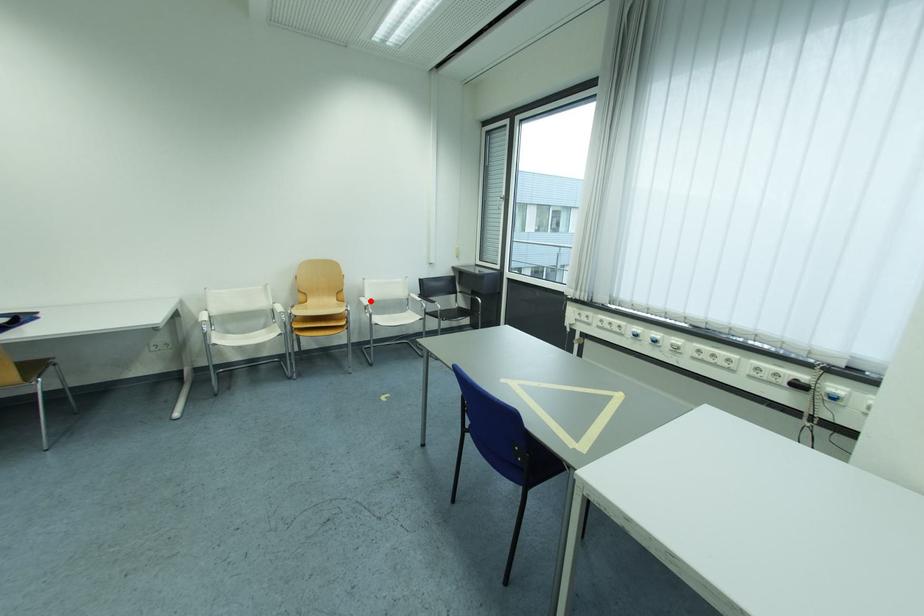
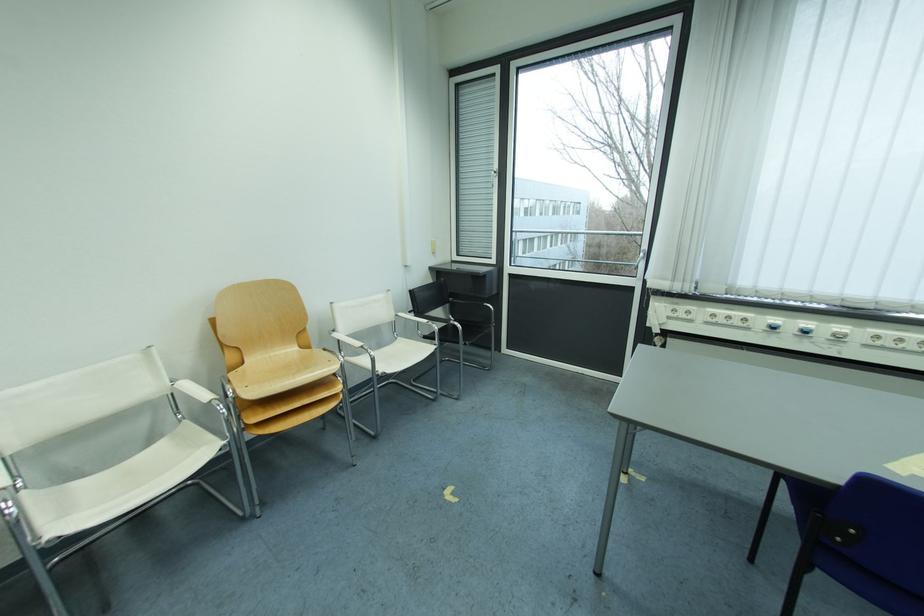
The point at the highlighted location is marked in the first image. Where is the corresponding point in the second image?

(344, 338)